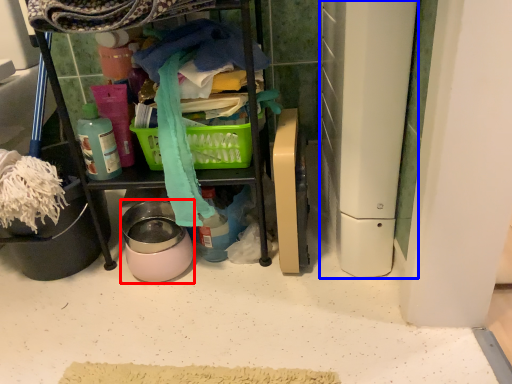
Question: Which object is further to the camera taking this photo, appliance (highlighted by a red box) or appliance (highlighted by a blue box)?

Choices:
 (A) appliance
 (B) appliance

Answer: (A)